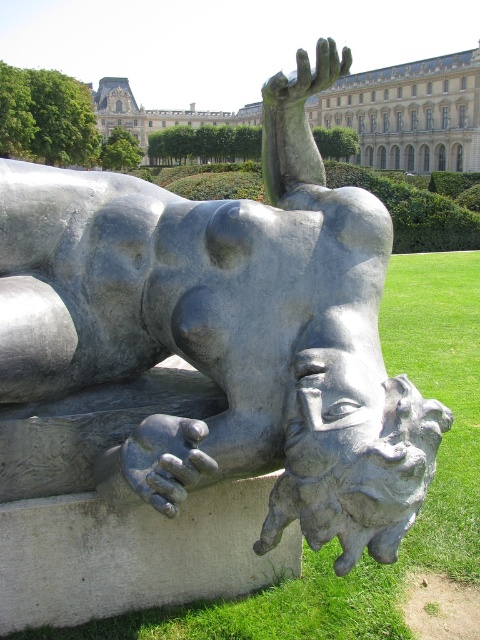
Question: Can you confirm if gray stone building at upper center is wider than gray stone hand at upper center?

Choices:
 (A) no
 (B) yes

Answer: (B)

Question: Is gray stone building at upper center positioned at the back of polished silver hand at lower center?

Choices:
 (A) no
 (B) yes

Answer: (B)

Question: Which of the following is the farthest from the observer?

Choices:
 (A) (297, 56)
 (B) (396, 97)

Answer: (B)

Question: Which point is farther to the camera?

Choices:
 (A) (171, 445)
 (B) (324, 58)

Answer: (B)

Question: Which object appears farthest from the camera in this image?

Choices:
 (A) polished silver hand at lower center
 (B) gray stone hand at upper center
 (C) gray stone building at upper center

Answer: (C)

Question: Is gray stone building at upper center smaller than polished silver hand at lower center?

Choices:
 (A) no
 (B) yes

Answer: (A)